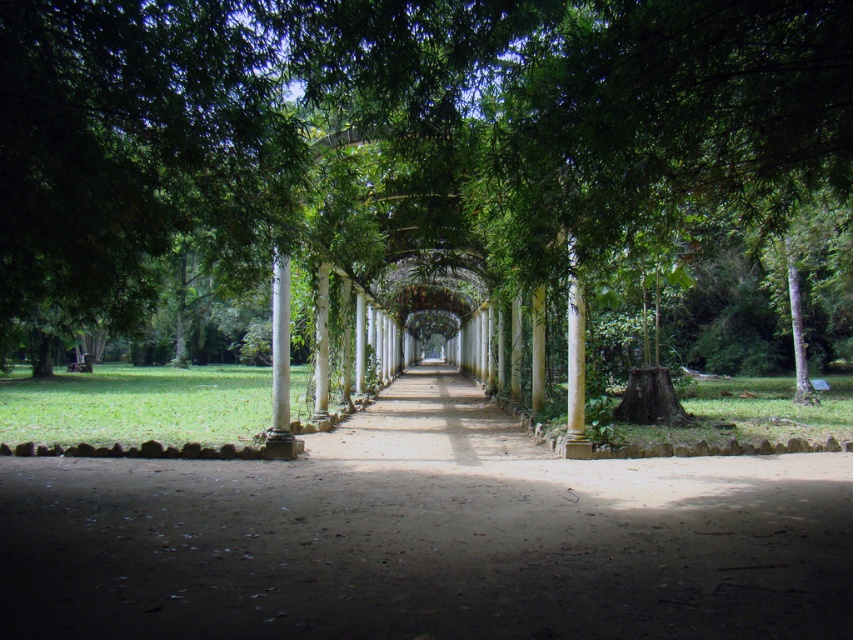
You are standing at the entrance of the garden pathway and see the point marked at coordinates (433, 170). Based on the garden scene described, what does this point most likely represent?

The point at coordinates (433, 170) most likely represents the location of the green leafy tree at center.

You are a gardener who wants to plant a new tree in the garden. The tree you have is as wide as the smooth concrete alley at center. Can you plant it in the space where the green leafy tree at center is currently located?

The green leafy tree at center is wider than the smooth concrete alley at center. Since your new tree is as wide as the alley, it would be narrower than the existing tree. Therefore, the space where the green leafy tree at center is located can accommodate your new tree.

You are standing at the entrance of the garden and want to take a photo of the green leafy tree at center and the smooth concrete alley at center. Which object will appear taller in your photo?

The green leafy tree at center will appear taller in the photo because it has a greater height compared to the smooth concrete alley at center.